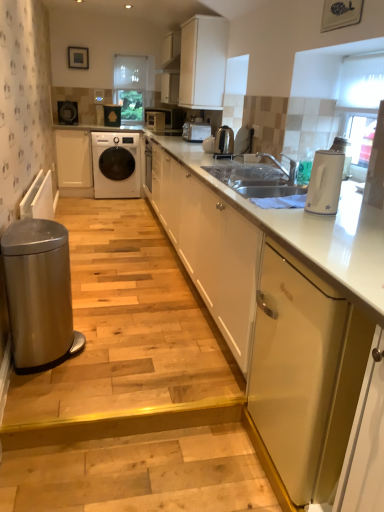
You are a GUI agent. You are given a task and a screenshot of the screen. Output one action in this format:
    pyautogui.click(x=<x>, y=<y>)
    Task: Click on the vacant space to the right of stainless steel water heater at lower left
    This screenshot has width=384, height=512.
    Given the screenshot: What is the action you would take?
    pyautogui.click(x=122, y=359)